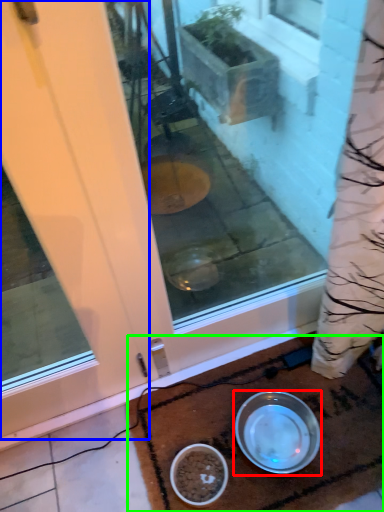
Question: Which object is positioned farthest from bowl (highlighted by a red box)? Select from door (highlighted by a blue box) and doormat (highlighted by a green box).

Choices:
 (A) door
 (B) doormat

Answer: (A)